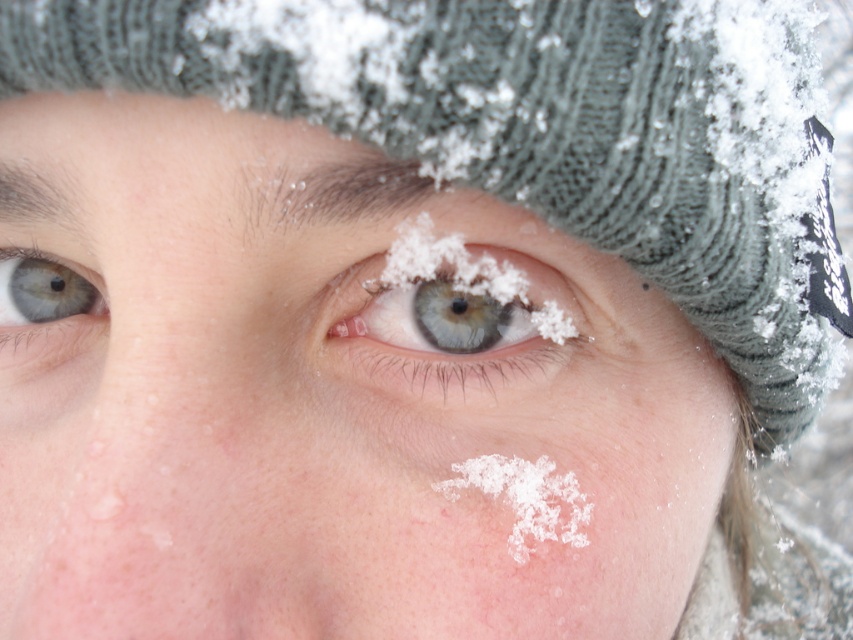
You are a photographer trying to capture the perfect shot of the person in the snow. You need to ensure that both the blue matte eye at center and the blue matte eye at upper left are in focus. Given that your camera lens has a depth of field that can sharply focus on objects within a 4.5 inch range, will both eyes be in focus?

The distance between the blue matte eye at center and the blue matte eye at upper left is 4.41 inches, which is within the camera lens depth of field range of 4.5 inches. Therefore, both eyes will be in focus.

You are a photographer trying to capture the beauty of winter elements on a person. You notice the blue matte eye at center and the white crystalline snowflake at lower center. Which of these two elements would appear larger in your photo?

The blue matte eye at center is bigger than the white crystalline snowflake at lower center, so it would appear larger in the photo.